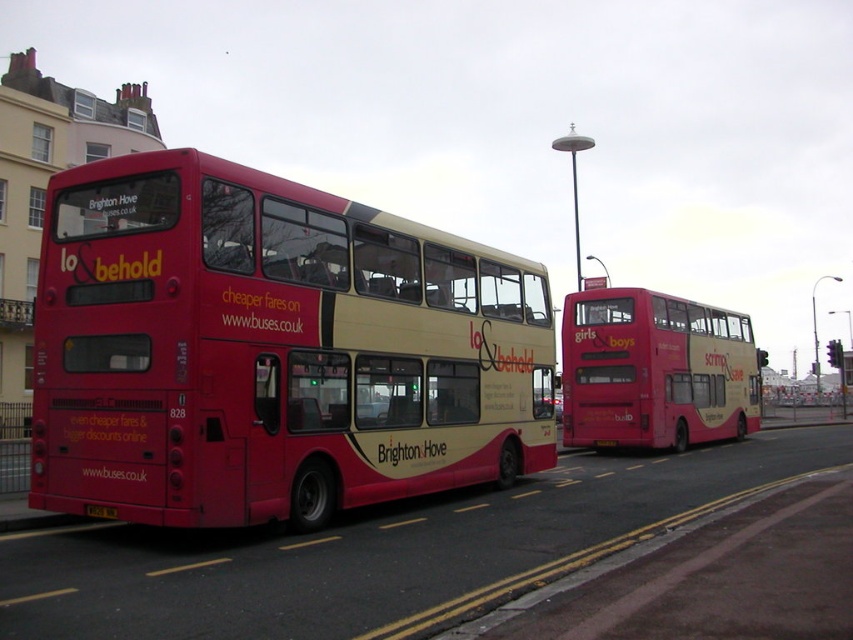
Can you confirm if matte red bus at left is thinner than black plastic license plate at rear?

No, matte red bus at left is not thinner than black plastic license plate at rear.

Who is shorter, matte red bus at left or black plastic license plate at rear?

With less height is black plastic license plate at rear.

Between point (299, 241) and point (90, 504), which one is positioned in front?

Point (90, 504) is in front.

Find the location of a particular element. matte red bus at left is located at coordinates (271, 349).

Is point (701, 314) farther from camera compared to point (109, 515)?

That is True.

Where is `matte pink bus at center`? matte pink bus at center is located at coordinates (654, 371).

Does matte red bus at left appear on the right side of matte pink bus at center?

In fact, matte red bus at left is to the left of matte pink bus at center.

Can you confirm if matte red bus at left is positioned above matte pink bus at center?

Indeed, matte red bus at left is positioned over matte pink bus at center.

Who is more distant from viewer, (210,227) or (585,292)?

Positioned behind is point (585,292).

This screenshot has width=853, height=640. Find the location of `matte red bus at left`. matte red bus at left is located at coordinates (271, 349).